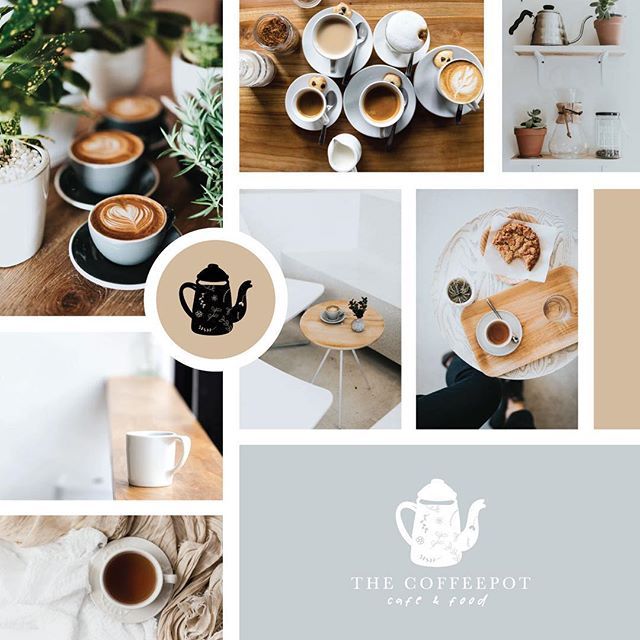
Where is `spoons`? This screenshot has height=640, width=640. spoons is located at coordinates (492, 304), (328, 120), (394, 130), (461, 109), (413, 56), (354, 54).